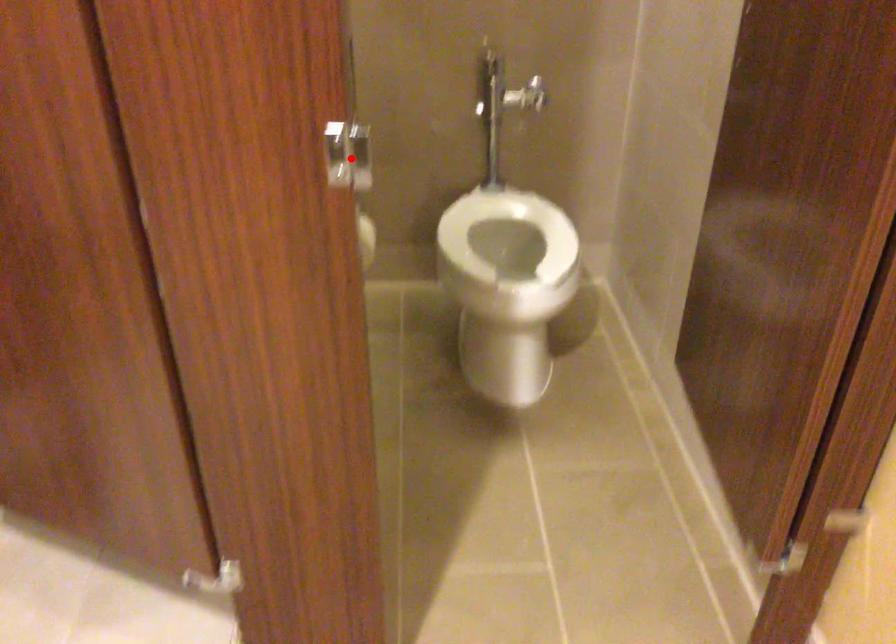
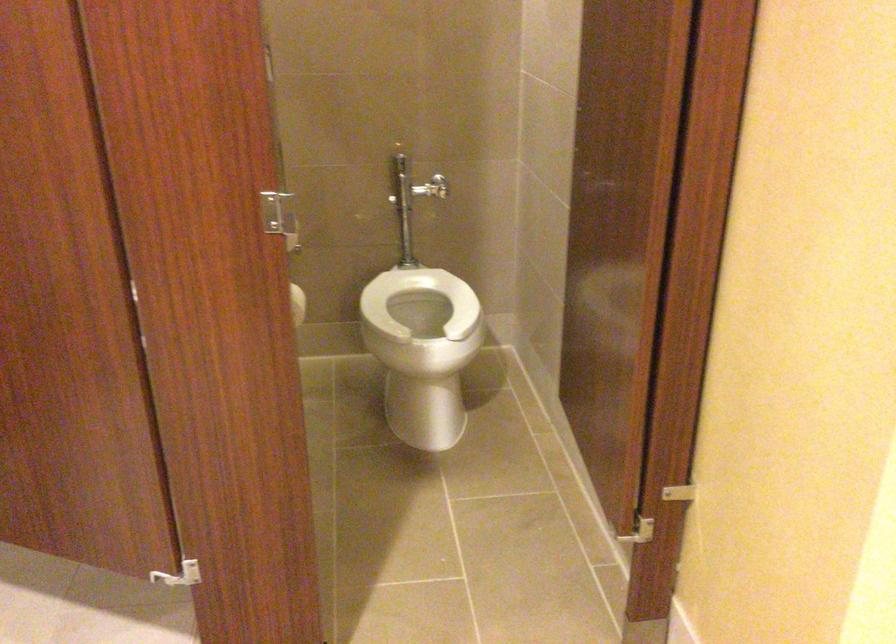
Question: I am providing you with two images of the same scene from different viewpoints. A red point is shown in image1. For the corresponding object point in image2, is it positioned nearer or farther from the camera?

Choices:
 (A) Nearer
 (B) Farther

Answer: (B)